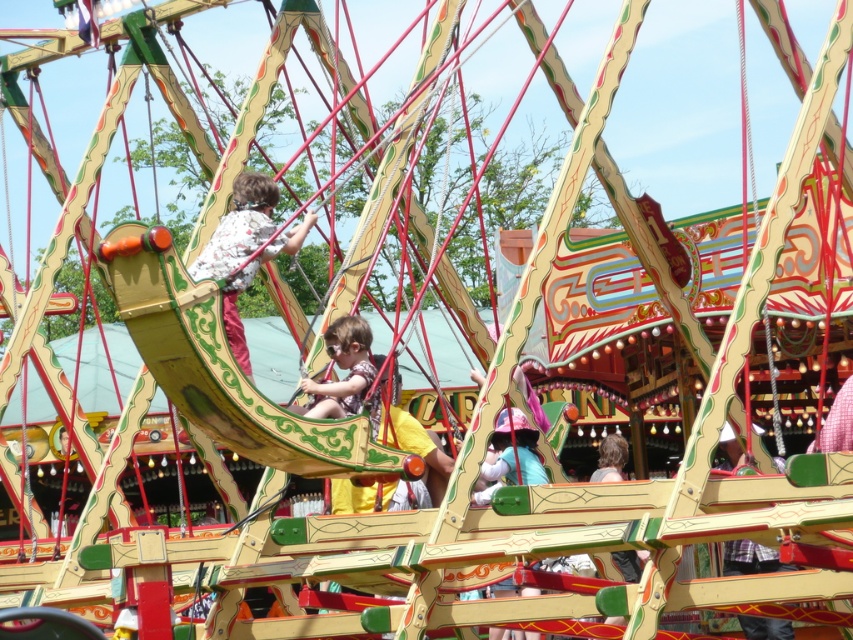
Is floral shirt fabric at center behind matte yellow swing at center?

No, floral shirt fabric at center is closer to the viewer.

Does floral shirt fabric at center appear over matte yellow swing at center?

Indeed, floral shirt fabric at center is positioned over matte yellow swing at center.

Which is behind, point (236, 308) or point (335, 392)?

The point (236, 308) is more distant.

This screenshot has width=853, height=640. What are the coordinates of `floral shirt fabric at center` in the screenshot? It's located at (238, 227).